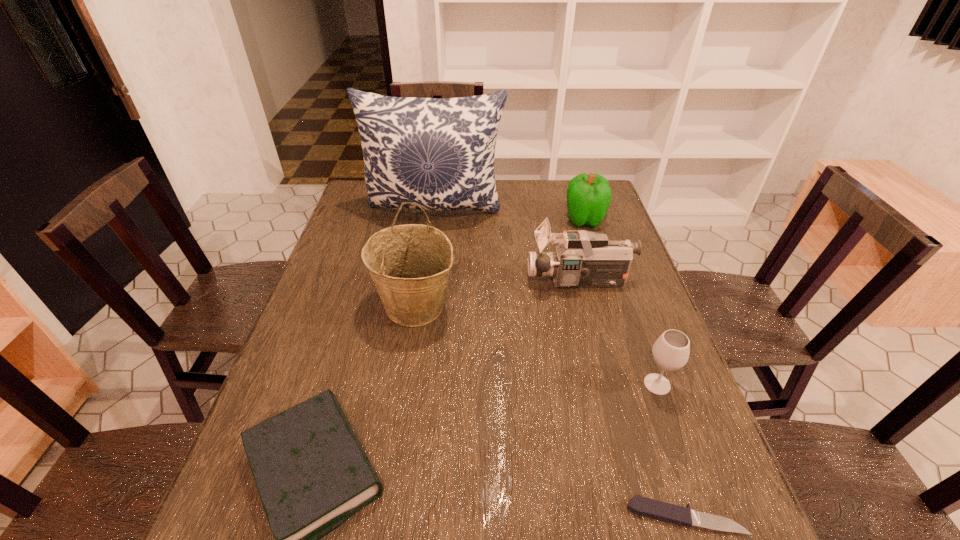
You are a GUI agent. You are given a task and a screenshot of the screen. Output one action in this format:
    pyautogui.click(x=<x>, y=<y>)
    Task: Click on the free space between the camcorder and the fifth farthest object
    The image size is (960, 540).
    Given the screenshot: What is the action you would take?
    pyautogui.click(x=618, y=333)

You are a GUI agent. You are given a task and a screenshot of the screen. Output one action in this format:
    pyautogui.click(x=<x>, y=<y>)
    Task: Click on the free space between the cushion and the third nearest object
    
    Given the screenshot: What is the action you would take?
    pyautogui.click(x=546, y=298)

This screenshot has width=960, height=540. What are the coordinates of `vacant area that lies between the shortest object and the wineglass` in the screenshot? It's located at (671, 450).

Point out which object is positioned as the nearest to the wineglass. Please provide its 2D coordinates. Your answer should be formatted as a tuple, i.e. [(x, y)], where the tuple contains the x and y coordinates of a point satisfying the conditions above.

[(658, 510)]

Choose which object is the nearest neighbor to the camcorder. Please provide its 2D coordinates. Your answer should be formatted as a tuple, i.e. [(x, y)], where the tuple contains the x and y coordinates of a point satisfying the conditions above.

[(588, 196)]

At what (x,y) coordinates should I click in order to perform the action: click on free location that satisfies the following two spatial constraints: 1. on the front side of the shortest object; 2. on the left side of the bell pepper. Please return your answer as a coordinate pair (x, y). Image resolution: width=960 pixels, height=540 pixels. Looking at the image, I should click on (679, 517).

Find the location of a particular element. Image resolution: width=960 pixels, height=540 pixels. free point that satisfies the following two spatial constraints: 1. on the front-facing side of the wineglass; 2. on the left side of the camcorder is located at coordinates (606, 384).

Find the location of a particular element. free space that satisfies the following two spatial constraints: 1. on the front surface of the wineglass; 2. on the right side of the tallest object is located at coordinates (412, 384).